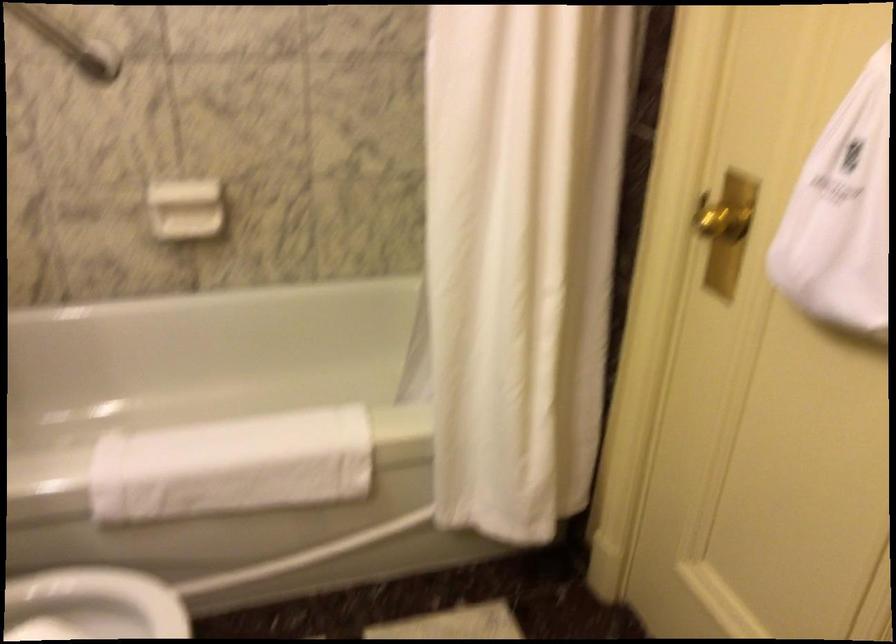
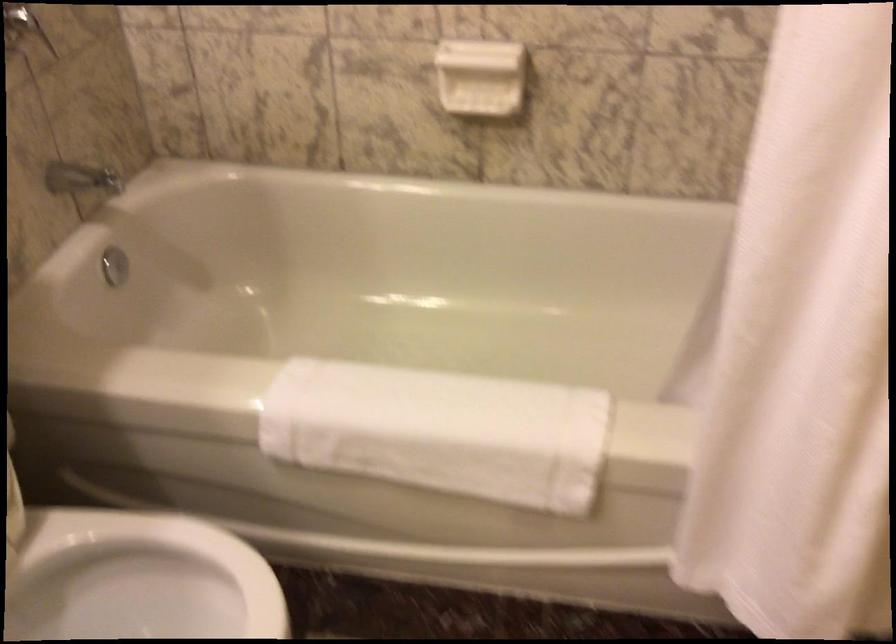
Where in the second image is the point corresponding to [183,200] from the first image?

(480, 77)